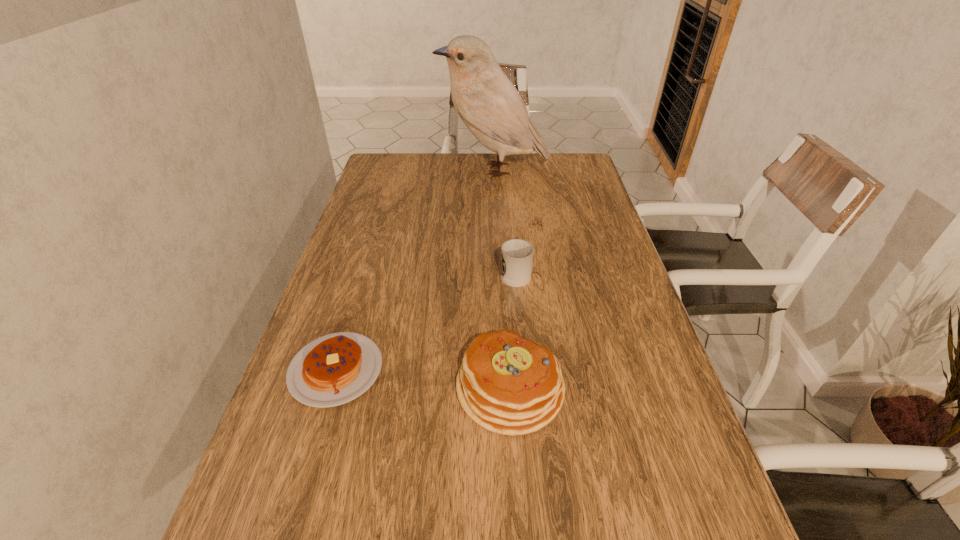
Image resolution: width=960 pixels, height=540 pixels. I want to click on vacant region located 0.390m on the back of the taller pancake, so click(501, 241).

The height and width of the screenshot is (540, 960). Identify the location of free spot located on the side of the second farthest object where the handle is located. (509, 200).

In order to click on blank space located on the side of the second farthest object where the handle is located in this screenshot , I will do `click(508, 193)`.

You are a GUI agent. You are given a task and a screenshot of the screen. Output one action in this format:
    pyautogui.click(x=<x>, y=<y>)
    Task: Click on the vacant space positioned on the side of the second farthest object where the handle is located
    The width and height of the screenshot is (960, 540).
    Given the screenshot: What is the action you would take?
    [x=511, y=225]

At what (x,y) coordinates should I click in order to perform the action: click on vacant space situated on the right of the shorter pancake. Please return your answer as a coordinate pair (x, y). Looking at the image, I should click on (454, 370).

You are a GUI agent. You are given a task and a screenshot of the screen. Output one action in this format:
    pyautogui.click(x=<x>, y=<y>)
    Task: Click on the object that is at the far edge
    Image resolution: width=960 pixels, height=540 pixels.
    Given the screenshot: What is the action you would take?
    pyautogui.click(x=491, y=107)

This screenshot has height=540, width=960. Find the location of `object present at the left edge`. object present at the left edge is located at coordinates (334, 369).

This screenshot has height=540, width=960. Find the location of `object that is at the right edge`. object that is at the right edge is located at coordinates tap(491, 107).

Find the location of a particular element. This screenshot has width=960, height=540. object situated at the far right corner is located at coordinates (491, 107).

Where is `vacant space at the far edge`? Image resolution: width=960 pixels, height=540 pixels. vacant space at the far edge is located at coordinates (474, 166).